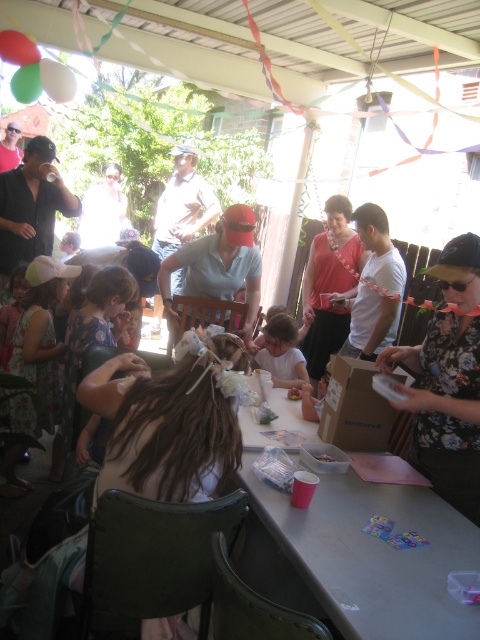
Does point (260, 490) come farther from viewer compared to point (300, 362)?

No, (260, 490) is closer to viewer.

This screenshot has width=480, height=640. I want to click on gray plastic table at center, so click(358, 556).